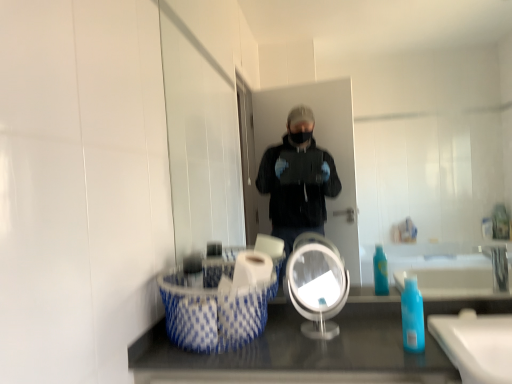
Question: From a real-world perspective, does blue translucent bottle at lower right sit lower than clear glass mirror at center, the second mirror viewed from the front?

Choices:
 (A) no
 (B) yes

Answer: (B)

Question: Can you confirm if blue translucent bottle at lower right is positioned to the left of clear glass mirror at center, the second mirror viewed from the front?

Choices:
 (A) yes
 (B) no

Answer: (B)

Question: Is blue translucent bottle at lower right at the right side of clear glass mirror at center, which is the 1th mirror from back to front?

Choices:
 (A) no
 (B) yes

Answer: (B)

Question: From the image's perspective, does blue translucent bottle at lower right appear lower than clear glass mirror at center, the second mirror viewed from the front?

Choices:
 (A) yes
 (B) no

Answer: (A)

Question: Can you confirm if blue translucent bottle at lower right is thinner than clear glass mirror at center, which is the 1th mirror from back to front?

Choices:
 (A) no
 (B) yes

Answer: (A)

Question: From a real-world perspective, relative to clear glass mirror at center, the second mirror viewed from the front, is blue translucent bottle at lower right vertically above or below?

Choices:
 (A) below
 (B) above

Answer: (A)

Question: Is blue translucent bottle at lower right to the left or to the right of clear glass mirror at center, the second mirror viewed from the front, in the image?

Choices:
 (A) right
 (B) left

Answer: (A)

Question: Choose the correct answer: Is blue translucent bottle at lower right inside clear glass mirror at center, the second mirror viewed from the front, or outside it?

Choices:
 (A) outside
 (B) inside

Answer: (A)

Question: From the image's perspective, is blue translucent bottle at lower right located above or below clear glass mirror at center, which is the 1th mirror from back to front?

Choices:
 (A) below
 (B) above

Answer: (A)

Question: Relative to clear glass mirror at center, the second mirror viewed from the front, is blue and white woven laundry basket at lower left in front or behind?

Choices:
 (A) behind
 (B) front

Answer: (B)

Question: Is point (216, 327) positioned closer to the camera than point (454, 92)?

Choices:
 (A) closer
 (B) farther

Answer: (A)

Question: Is blue and white woven laundry basket at lower left bigger or smaller than clear glass mirror at center, the second mirror viewed from the front?

Choices:
 (A) small
 (B) big

Answer: (A)

Question: Do you think blue and white woven laundry basket at lower left is within clear glass mirror at center, which is the 1th mirror from back to front, or outside of it?

Choices:
 (A) inside
 (B) outside

Answer: (B)

Question: Based on their sizes in the image, would you say clear glass mirror at center, which is the 1th mirror from back to front, is bigger or smaller than clear plastic mirror at center, positioned as the 2th mirror in back-to-front order?

Choices:
 (A) big
 (B) small

Answer: (A)

Question: From the image's perspective, is clear glass mirror at center, which is the 1th mirror from back to front, above or below clear plastic mirror at center, the first mirror positioned from the front?

Choices:
 (A) below
 (B) above

Answer: (B)